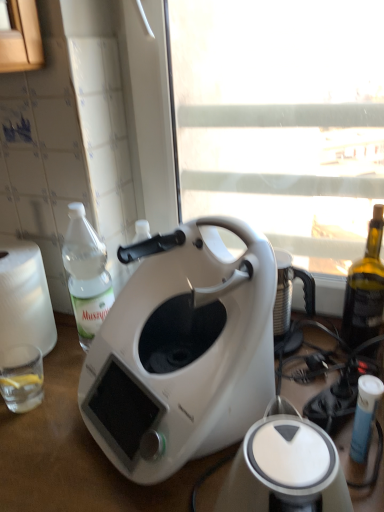
The width and height of the screenshot is (384, 512). I want to click on free space on the front side of clear glass at lower left, so click(41, 457).